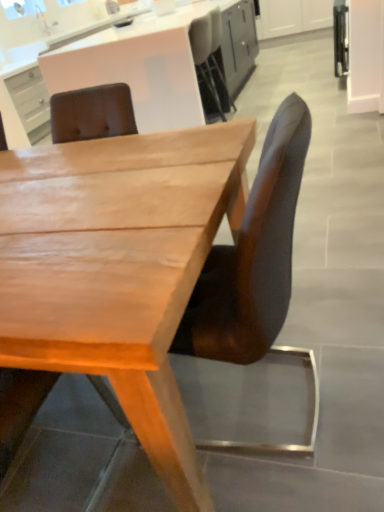
Question: From the image's perspective, is light brown wood desk at center on brown leather chair at center, the 2th chair when ordered from left to right?

Choices:
 (A) yes
 (B) no

Answer: (B)

Question: Is light brown wood desk at center bigger than brown leather chair at center, arranged as the first chair when viewed from the right?

Choices:
 (A) no
 (B) yes

Answer: (B)

Question: From a real-world perspective, is light brown wood desk at center beneath brown leather chair at center, arranged as the first chair when viewed from the right?

Choices:
 (A) yes
 (B) no

Answer: (A)

Question: Does light brown wood desk at center have a smaller size compared to brown leather chair at center, arranged as the first chair when viewed from the right?

Choices:
 (A) no
 (B) yes

Answer: (A)

Question: Considering the relative sizes of light brown wood desk at center and brown leather chair at center, the 2th chair when ordered from left to right, in the image provided, is light brown wood desk at center thinner than brown leather chair at center, the 2th chair when ordered from left to right,?

Choices:
 (A) yes
 (B) no

Answer: (B)

Question: From the image's perspective, is brown leather chair at center, the 2th chair when ordered from left to right, above or below wooden chair at center, acting as the 2th chair starting from the right?

Choices:
 (A) below
 (B) above

Answer: (B)

Question: Looking at the image, does brown leather chair at center, arranged as the first chair when viewed from the right, seem bigger or smaller compared to wooden chair at center, acting as the 2th chair starting from the right?

Choices:
 (A) small
 (B) big

Answer: (B)

Question: In the image, is brown leather chair at center, arranged as the first chair when viewed from the right, on the left side or the right side of wooden chair at center, acting as the 2th chair starting from the right?

Choices:
 (A) right
 (B) left

Answer: (A)

Question: Considering the positions of brown leather chair at center, arranged as the first chair when viewed from the right, and wooden chair at center, the 1th chair viewed from the left, in the image, is brown leather chair at center, arranged as the first chair when viewed from the right, wider or thinner than wooden chair at center, the 1th chair viewed from the left,?

Choices:
 (A) thin
 (B) wide

Answer: (B)

Question: Looking at their shapes, would you say brown leather chair at center, arranged as the first chair when viewed from the right, is wider or thinner than light brown wood desk at center?

Choices:
 (A) wide
 (B) thin

Answer: (B)

Question: From the image's perspective, relative to light brown wood desk at center, is brown leather chair at center, arranged as the first chair when viewed from the right, above or below?

Choices:
 (A) below
 (B) above

Answer: (B)

Question: Do you think brown leather chair at center, the 2th chair when ordered from left to right, is within light brown wood desk at center, or outside of it?

Choices:
 (A) inside
 (B) outside

Answer: (A)

Question: From their relative heights in the image, would you say brown leather chair at center, arranged as the first chair when viewed from the right, is taller or shorter than light brown wood desk at center?

Choices:
 (A) tall
 (B) short

Answer: (A)

Question: Is wooden chair at center, acting as the 2th chair starting from the right, to the left or to the right of light brown wood desk at center in the image?

Choices:
 (A) left
 (B) right

Answer: (A)

Question: In terms of height, does wooden chair at center, acting as the 2th chair starting from the right, look taller or shorter compared to light brown wood desk at center?

Choices:
 (A) short
 (B) tall

Answer: (B)